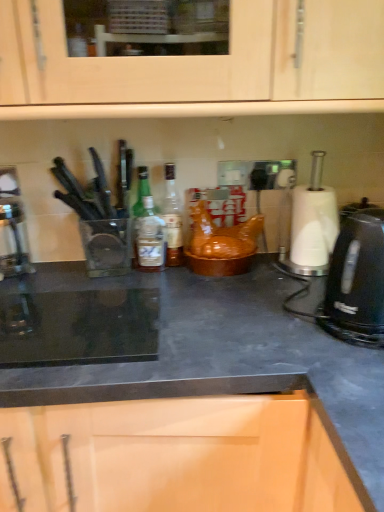
Question: Can you confirm if translucent glass bottle at center is bigger than black matte countertop at center?

Choices:
 (A) no
 (B) yes

Answer: (A)

Question: From a real-world perspective, is translucent glass bottle at center positioned under black matte countertop at center based on gravity?

Choices:
 (A) yes
 (B) no

Answer: (B)

Question: Does translucent glass bottle at center have a lesser width compared to black matte countertop at center?

Choices:
 (A) no
 (B) yes

Answer: (B)

Question: Considering the relative positions of translucent glass bottle at center and black matte countertop at center in the image provided, is translucent glass bottle at center behind black matte countertop at center?

Choices:
 (A) no
 (B) yes

Answer: (B)

Question: Considering the relative sizes of translucent glass bottle at center and black matte countertop at center in the image provided, is translucent glass bottle at center wider than black matte countertop at center?

Choices:
 (A) yes
 (B) no

Answer: (B)

Question: In the image, is translucent glass bottle at center positioned in front of or behind black matte countertop at center?

Choices:
 (A) behind
 (B) front

Answer: (A)

Question: From the image's perspective, is translucent glass bottle at center above or below black matte countertop at center?

Choices:
 (A) above
 (B) below

Answer: (A)

Question: Is point (170, 212) closer or farther from the camera than point (64, 266)?

Choices:
 (A) farther
 (B) closer

Answer: (B)

Question: Would you say translucent glass bottle at center is to the left or to the right of black matte countertop at center in the picture?

Choices:
 (A) left
 (B) right

Answer: (A)

Question: From the image's perspective, is black plastic kettle at right positioned above or below translucent glass bottle at center?

Choices:
 (A) above
 (B) below

Answer: (B)

Question: Based on their positions, is black plastic kettle at right located to the left or right of translucent glass bottle at center?

Choices:
 (A) right
 (B) left

Answer: (A)

Question: Is black plastic kettle at right wider or thinner than translucent glass bottle at center?

Choices:
 (A) thin
 (B) wide

Answer: (B)

Question: From a real-world perspective, is black plastic kettle at right above or below translucent glass bottle at center?

Choices:
 (A) above
 (B) below

Answer: (B)

Question: Considering the positions of point (382, 455) and point (370, 315), is point (382, 455) closer or farther from the camera than point (370, 315)?

Choices:
 (A) farther
 (B) closer

Answer: (B)

Question: Considering their positions, is black matte countertop at center located in front of or behind black plastic kettle at right?

Choices:
 (A) behind
 (B) front

Answer: (B)